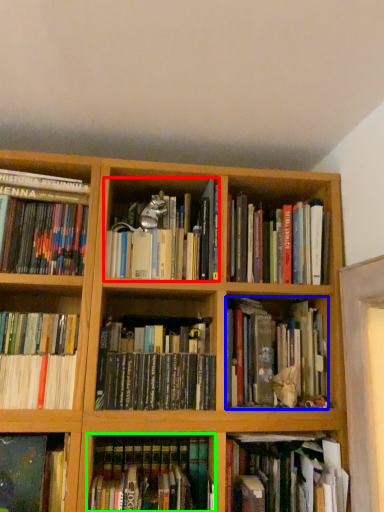
Question: Based on their relative distances, which object is farther from book (highlighted by a red box)? Choose from book (highlighted by a blue box) and book (highlighted by a green box).

Choices:
 (A) book
 (B) book

Answer: (B)